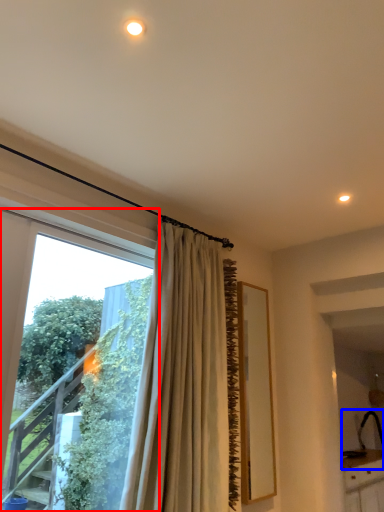
Question: Which point is closer to the camera, window (highlighted by a red box) or sink (highlighted by a blue box)?

Choices:
 (A) window
 (B) sink

Answer: (A)